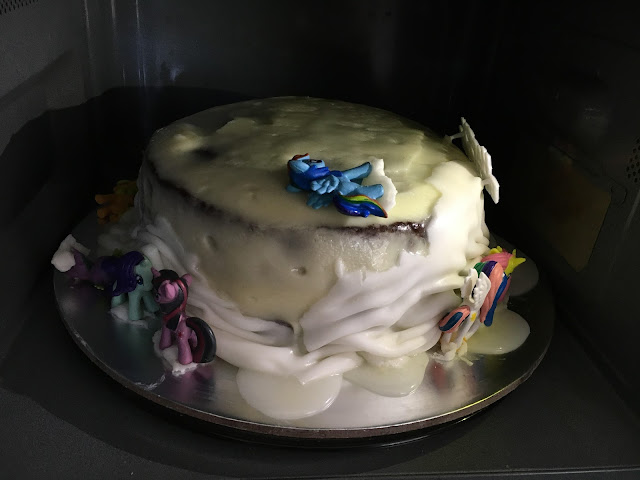
Locate an element on the screen. cake platter is located at coordinates (409, 403).